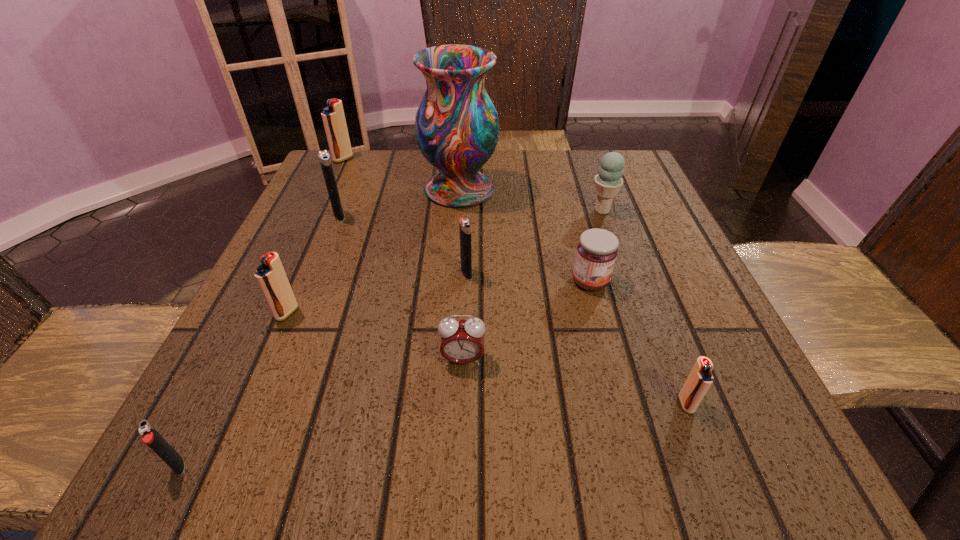
Find the location of a particular element. This screenshot has height=540, width=960. object at the near edge is located at coordinates (150, 435).

The image size is (960, 540). Find the location of `ice cream present at the right edge`. ice cream present at the right edge is located at coordinates (608, 181).

Image resolution: width=960 pixels, height=540 pixels. I want to click on jam that is at the right edge, so click(597, 250).

At what (x,y) coordinates should I click in order to perform the action: click on igniter present at the right edge. Please return your answer as a coordinate pair (x, y). The image size is (960, 540). Looking at the image, I should click on (700, 378).

This screenshot has width=960, height=540. Identify the location of object that is at the far left corner. (333, 117).

Where is `object at the near left corner`? object at the near left corner is located at coordinates (150, 435).

At what (x,y) coordinates should I click in order to perform the action: click on vacant space at the near edge of the desktop. Please return your answer as a coordinate pair (x, y). This screenshot has width=960, height=540. Looking at the image, I should click on coord(312,462).

Locate an element on the screen. free point at the left edge is located at coordinates (285, 397).

In the image, there is a desktop. What are the coordinates of `free space at the right edge` in the screenshot? It's located at pos(659,224).

Locate an element on the screen. Image resolution: width=960 pixels, height=540 pixels. vacant space at the far left corner of the desktop is located at coordinates (364, 188).